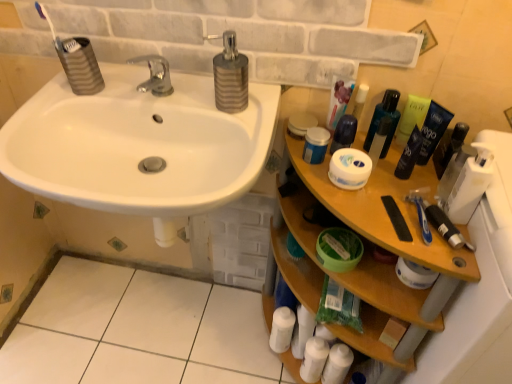
The height and width of the screenshot is (384, 512). Find the location of `free space to the left of translucent plastic bottle at right, which is counted as the 7th mouthwash, starting from the left`. free space to the left of translucent plastic bottle at right, which is counted as the 7th mouthwash, starting from the left is located at coordinates (389, 183).